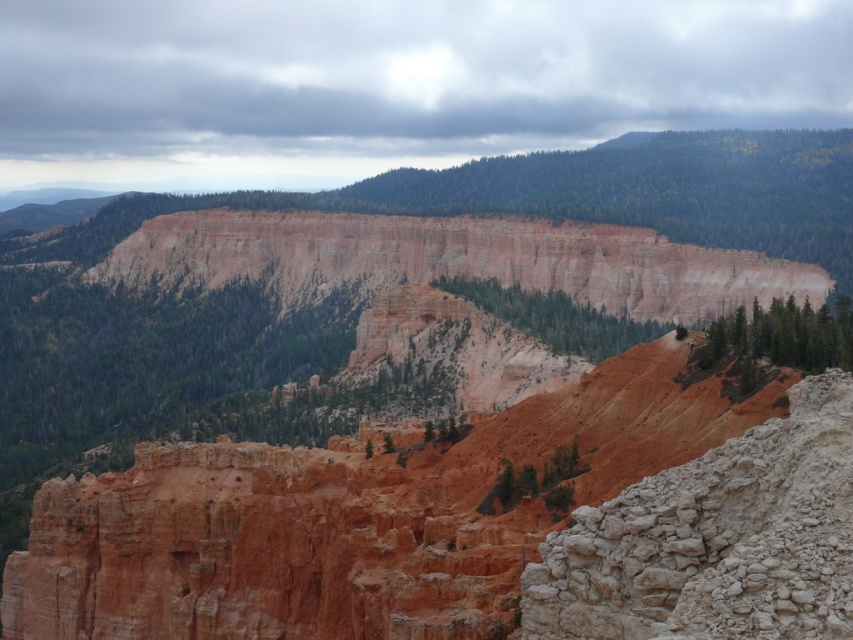
Question: Is white rough rock at center right to the right of green matte trees at right from the viewer's perspective?

Choices:
 (A) no
 (B) yes

Answer: (A)

Question: Can you confirm if green textured trees at center is smaller than green matte trees at right?

Choices:
 (A) no
 (B) yes

Answer: (B)

Question: Which is farther from the green matte trees at right?

Choices:
 (A) white rough rock at center right
 (B) green textured trees at center

Answer: (A)

Question: Can you confirm if white rough rock at center right is positioned to the left of green matte trees at right?

Choices:
 (A) no
 (B) yes

Answer: (B)

Question: Which of the following is the closest to the observer?

Choices:
 (A) (790, 307)
 (B) (734, 556)
 (C) (529, 298)

Answer: (B)

Question: Estimate the real-world distances between objects in this image. Which object is farther from the white rough rock at center right?

Choices:
 (A) green matte trees at right
 (B) green textured trees at center

Answer: (B)